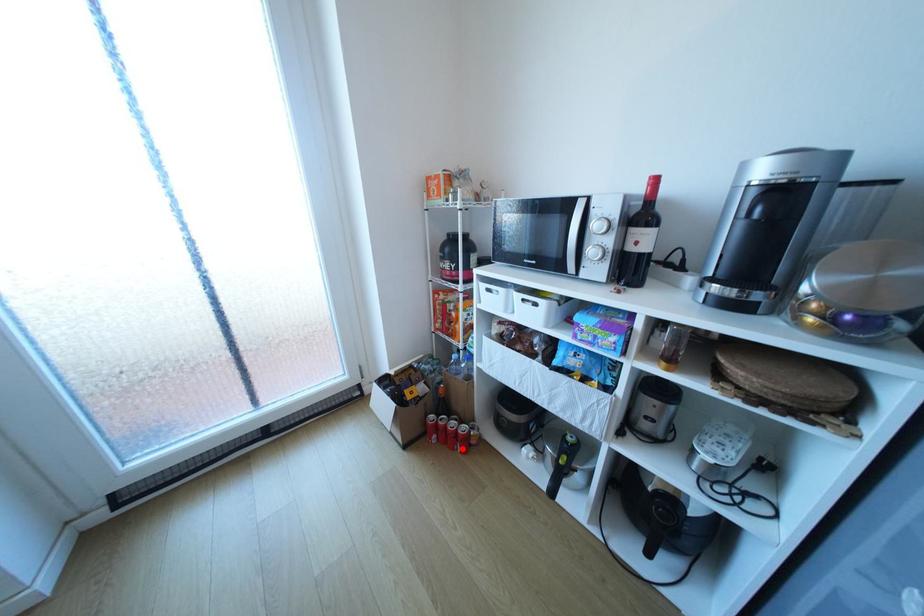
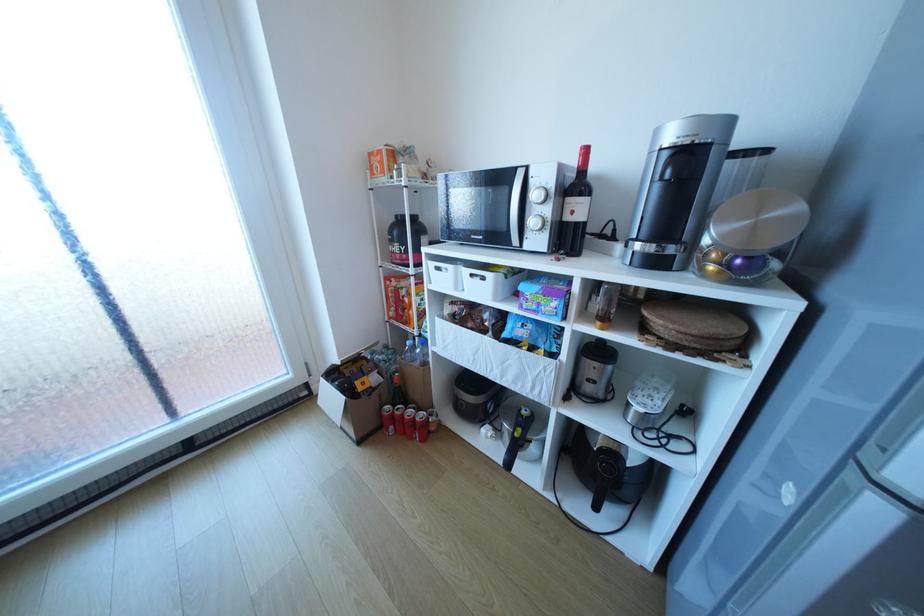
Question: I am providing you with two images of the same scene from different viewpoints. Image1 has a red point marked. In image2, the corresponding 3D location appears at what relative position? Reply with the corresponding letter.

Choices:
 (A) Closer
 (B) Farther

Answer: (A)